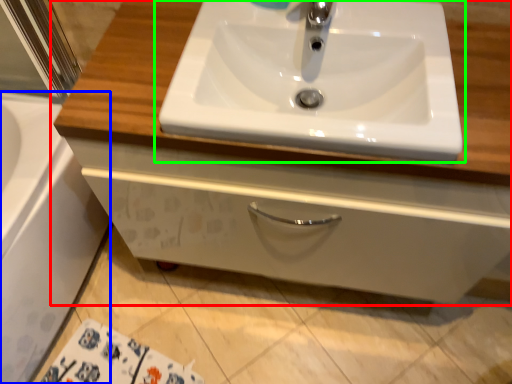
Question: Which object is positioned farthest from bathroom cabinet (highlighted by a red box)? Select from bath (highlighted by a blue box) and sink (highlighted by a green box).

Choices:
 (A) bath
 (B) sink

Answer: (A)